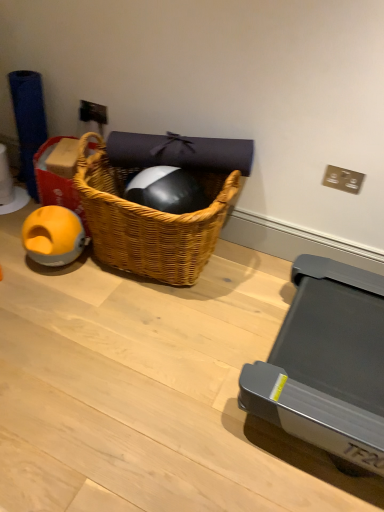
Question: Could you tell me if yellow rubber ball at left is turned towards orange rubber ball at left?

Choices:
 (A) no
 (B) yes

Answer: (B)

Question: Does yellow rubber ball at left appear on the right side of orange rubber ball at left?

Choices:
 (A) yes
 (B) no

Answer: (A)

Question: From the image's perspective, is yellow rubber ball at left over orange rubber ball at left?

Choices:
 (A) no
 (B) yes

Answer: (B)

Question: From the image's perspective, is yellow rubber ball at left below orange rubber ball at left?

Choices:
 (A) no
 (B) yes

Answer: (A)

Question: From a real-world perspective, is yellow rubber ball at left on orange rubber ball at left?

Choices:
 (A) yes
 (B) no

Answer: (A)

Question: From their relative heights in the image, would you say woven wood picnic basket at center is taller or shorter than orange rubber ball at left?

Choices:
 (A) tall
 (B) short

Answer: (A)

Question: From a real-world perspective, relative to orange rubber ball at left, is woven wood picnic basket at center vertically above or below?

Choices:
 (A) below
 (B) above

Answer: (B)

Question: Is woven wood picnic basket at center wider or thinner than orange rubber ball at left?

Choices:
 (A) wide
 (B) thin

Answer: (A)

Question: Would you say woven wood picnic basket at center is to the left or to the right of orange rubber ball at left in the picture?

Choices:
 (A) left
 (B) right

Answer: (B)

Question: From a real-world perspective, is orange rubber ball at left physically located above or below yellow rubber ball at left?

Choices:
 (A) below
 (B) above

Answer: (A)

Question: Considering the positions of point (67, 233) and point (67, 138), is point (67, 233) closer or farther from the camera than point (67, 138)?

Choices:
 (A) closer
 (B) farther

Answer: (A)

Question: Is orange rubber ball at left in front of or behind yellow rubber ball at left in the image?

Choices:
 (A) behind
 (B) front

Answer: (B)

Question: Visually, is orange rubber ball at left positioned to the left or to the right of yellow rubber ball at left?

Choices:
 (A) right
 (B) left

Answer: (B)

Question: From the image's perspective, is metallic silver power outlet at upper center above or below orange rubber ball at left?

Choices:
 (A) above
 (B) below

Answer: (A)

Question: From a real-world perspective, is metallic silver power outlet at upper center physically located above or below orange rubber ball at left?

Choices:
 (A) below
 (B) above

Answer: (B)